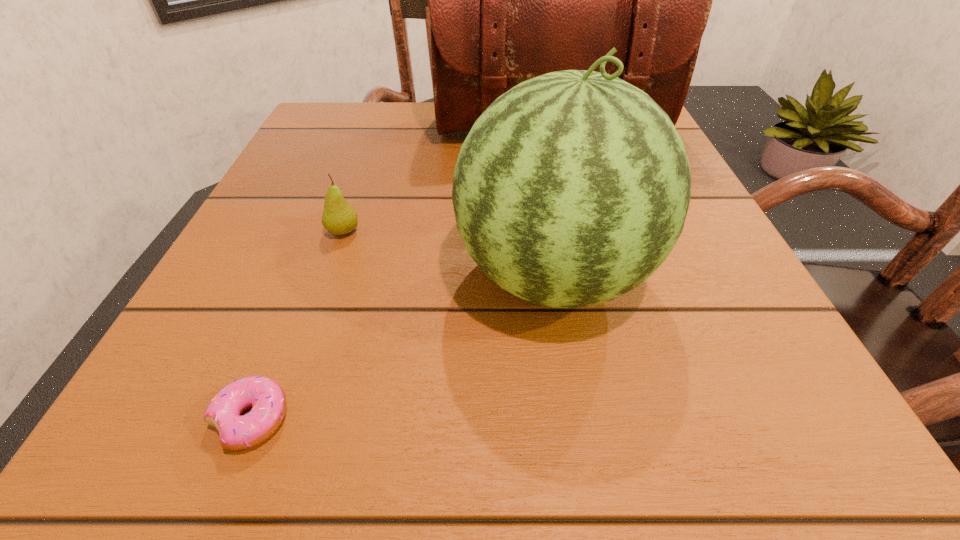
This screenshot has width=960, height=540. I want to click on vacant region between the pear and the satchel, so click(446, 181).

Where is `vacant region between the watermelon and the nearest object`? The height and width of the screenshot is (540, 960). vacant region between the watermelon and the nearest object is located at coordinates (402, 347).

The height and width of the screenshot is (540, 960). What are the coordinates of `object identified as the third closest to the watermelon` in the screenshot? It's located at (509, 0).

I want to click on object that is the closest one to the farthest object, so click(x=572, y=188).